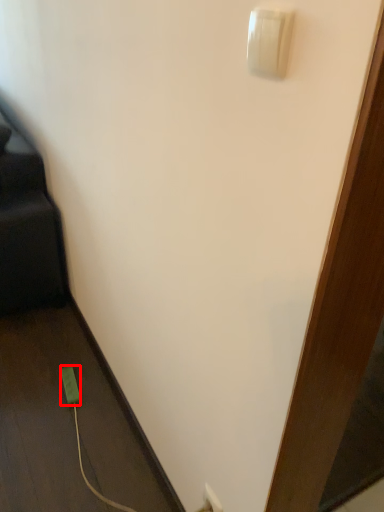
Question: Observing the image, what is the correct spatial positioning of power plugs and sockets (annotated by the red box) in reference to light switch?

Choices:
 (A) right
 (B) left

Answer: (B)